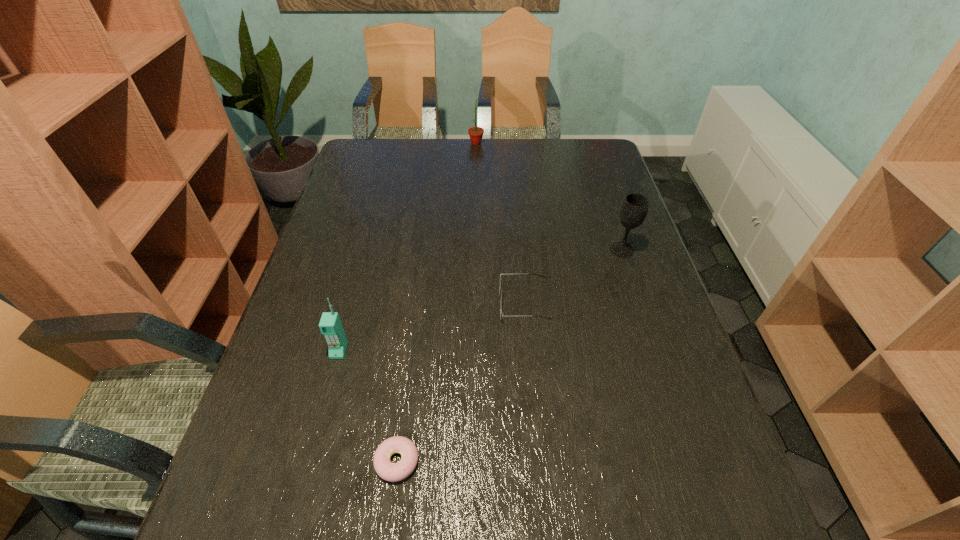
This screenshot has width=960, height=540. What are the coordinates of `free space between the fourth tallest object and the sunflower` in the screenshot? It's located at (500, 223).

Image resolution: width=960 pixels, height=540 pixels. I want to click on unoccupied area between the fourth nearest object and the fourth object from right to left, so click(510, 355).

Identify the location of vacant area that lies between the third object from right to left and the cellular telephone. (408, 247).

This screenshot has width=960, height=540. In order to click on blank region between the shortest object and the fourth object from left to right in this screenshot , I will do `click(461, 382)`.

Where is `object that stands as the second closest to the second nearest object`? object that stands as the second closest to the second nearest object is located at coordinates coord(501,315).

Find the location of a particular element. Image resolution: width=960 pixels, height=540 pixels. object that is the third closest to the cellular telephone is located at coordinates (634, 208).

Image resolution: width=960 pixels, height=540 pixels. Find the location of `free location that satisfies the following two spatial constraints: 1. on the back side of the second farthest object; 2. on the left side of the nearest object`. free location that satisfies the following two spatial constraints: 1. on the back side of the second farthest object; 2. on the left side of the nearest object is located at coordinates (424, 249).

You are a GUI agent. You are given a task and a screenshot of the screen. Output one action in this format:
    pyautogui.click(x=<x>, y=<y>)
    Task: Click on the free region that satisfies the following two spatial constraints: 1. on the face of the sunflower; 2. on the keypad of the leftmost object
    Image resolution: width=960 pixels, height=540 pixels.
    Given the screenshot: What is the action you would take?
    pyautogui.click(x=473, y=351)

Where is `free point that satisfies the following two spatial constraints: 1. on the front-facing side of the sunglasses; 2. on the keypad of the cellular telephone`? The width and height of the screenshot is (960, 540). free point that satisfies the following two spatial constraints: 1. on the front-facing side of the sunglasses; 2. on the keypad of the cellular telephone is located at coordinates (529, 351).

At what (x,y) coordinates should I click in order to perform the action: click on free space that satisfies the following two spatial constraints: 1. on the keypad of the second nearest object; 2. on the left side of the fourth object from right to left. Please return your answer as a coordinate pair (x, y). This screenshot has height=540, width=960. Looking at the image, I should click on (310, 461).